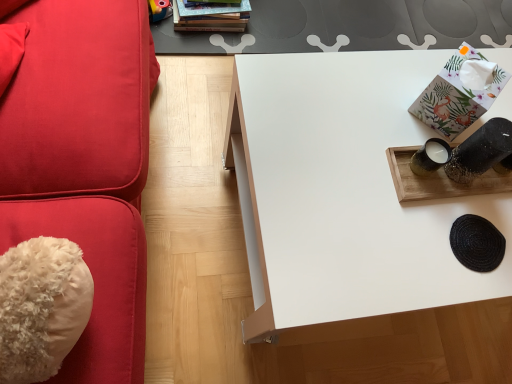
Where is `free space in front of floral paper tissue at upper right`? free space in front of floral paper tissue at upper right is located at coordinates (428, 169).